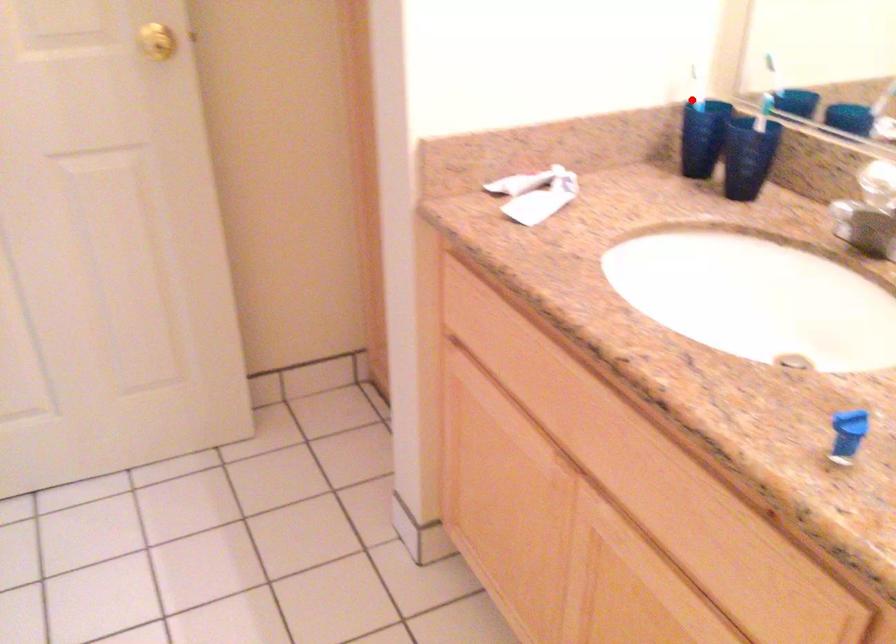
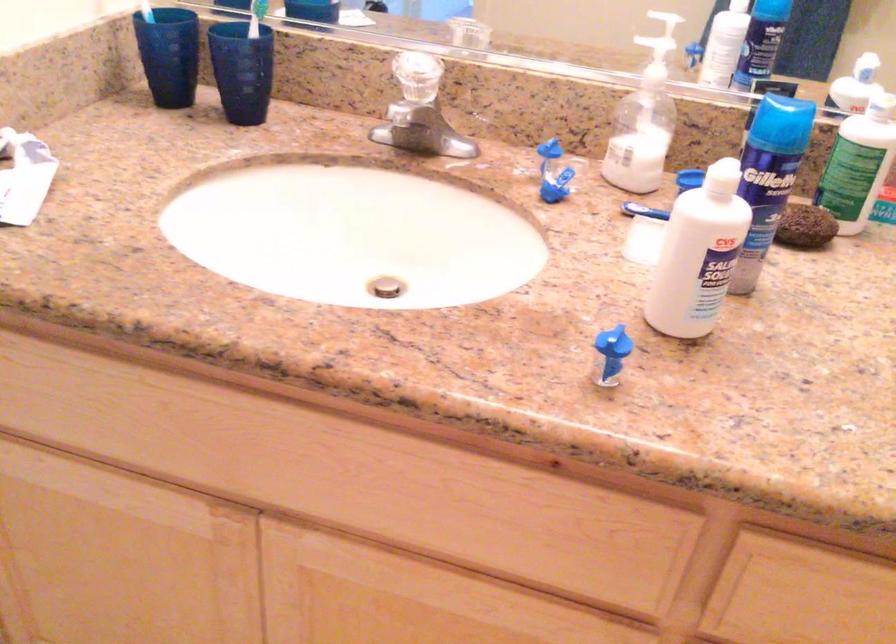
Question: I am providing you with two images of the same scene from different viewpoints. In image1, a red point is highlighted. Considering the same 3D point in image2, which of the following is correct?

Choices:
 (A) It is closer
 (B) It is farther

Answer: (A)